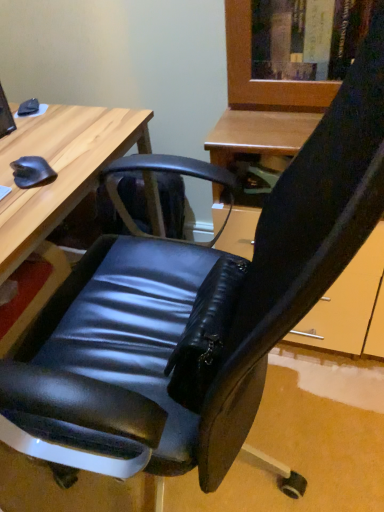
Question: Considering the relative positions of matte black monitor at upper left and wooden desk at left in the image provided, is matte black monitor at upper left to the right of wooden desk at left from the viewer's perspective?

Choices:
 (A) no
 (B) yes

Answer: (B)

Question: Is matte black monitor at upper left in contact with wooden desk at left?

Choices:
 (A) yes
 (B) no

Answer: (B)

Question: Is matte black monitor at upper left at the left side of wooden desk at left?

Choices:
 (A) no
 (B) yes

Answer: (A)

Question: From a real-world perspective, is matte black monitor at upper left on top of wooden desk at left?

Choices:
 (A) no
 (B) yes

Answer: (B)

Question: Can wooden desk at left be found inside matte black monitor at upper left?

Choices:
 (A) no
 (B) yes

Answer: (A)

Question: Is the depth of matte black monitor at upper left greater than that of wooden desk at left?

Choices:
 (A) no
 (B) yes

Answer: (B)

Question: Are wooden desk at left and matte black monitor at upper left far apart?

Choices:
 (A) no
 (B) yes

Answer: (A)

Question: Is the depth of wooden desk at left less than that of matte black monitor at upper left?

Choices:
 (A) no
 (B) yes

Answer: (B)

Question: From a real-world perspective, is wooden desk at left located higher than matte black monitor at upper left?

Choices:
 (A) no
 (B) yes

Answer: (A)

Question: Considering the relative sizes of wooden desk at left and matte black monitor at upper left in the image provided, is wooden desk at left smaller than matte black monitor at upper left?

Choices:
 (A) yes
 (B) no

Answer: (B)

Question: Can you confirm if wooden desk at left is positioned to the left of matte black monitor at upper left?

Choices:
 (A) yes
 (B) no

Answer: (A)

Question: Is matte black monitor at upper left surrounded by wooden desk at left?

Choices:
 (A) yes
 (B) no

Answer: (B)

Question: Does point (1, 105) appear closer or farther from the camera than point (84, 178)?

Choices:
 (A) farther
 (B) closer

Answer: (A)